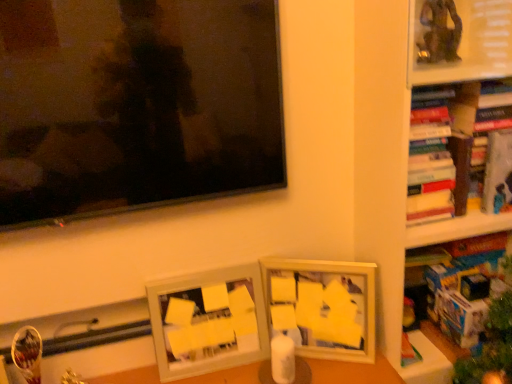
This screenshot has height=384, width=512. What are the coordinates of `hardcover book at upper right, the second book positioned from the bottom` in the screenshot? It's located at (498, 173).

You are a GUI agent. You are given a task and a screenshot of the screen. Output one action in this format:
    pyautogui.click(x=<x>, y=<y>)
    Task: Click on the hardcover book at upper right, the first book positioned from the top
    This screenshot has width=512, height=384.
    Given the screenshot: What is the action you would take?
    pyautogui.click(x=444, y=146)

Based on the photo, what is the approximate height of matte black television at upper left?

The height of matte black television at upper left is 21.85 inches.

The height and width of the screenshot is (384, 512). Identify the location of matte white picture frame at center, arranged as the 1th picture frame when viewed from the right. (326, 305).

The width and height of the screenshot is (512, 384). Identify the location of wooden bookshelf at right. pyautogui.click(x=456, y=116).

Image resolution: width=512 pixels, height=384 pixels. In order to click on blue cardboard book at right, arranged as the 3th book when viewed from the top in this screenshot , I will do `click(462, 283)`.

Consider the image. Would you say matte white picture frame at center, arranged as the 1th picture frame when viewed from the right, is a long distance from white matte picture frame at center, which is the 2th picture frame from right to left?

matte white picture frame at center, arranged as the 1th picture frame when viewed from the right, is actually quite close to white matte picture frame at center, which is the 2th picture frame from right to left.

How many degrees apart are the facing directions of matte white picture frame at center, arranged as the 1th picture frame when viewed from the right, and white matte picture frame at center, which is the 2th picture frame from right to left?

The angular difference between matte white picture frame at center, arranged as the 1th picture frame when viewed from the right, and white matte picture frame at center, which is the 2th picture frame from right to left, is 25.9 degrees.

Is matte white picture frame at center, the 2th picture frame when ordered from left to right, oriented towards white matte picture frame at center, which is counted as the 1th picture frame, starting from the left?

No, matte white picture frame at center, the 2th picture frame when ordered from left to right, is not turned towards white matte picture frame at center, which is counted as the 1th picture frame, starting from the left.

From the picture: From a real-world perspective, does matte white picture frame at center, the 2th picture frame when ordered from left to right, sit lower than white matte picture frame at center, which is counted as the 1th picture frame, starting from the left?

Yes, from a real-world perspective, matte white picture frame at center, the 2th picture frame when ordered from left to right, is below white matte picture frame at center, which is counted as the 1th picture frame, starting from the left.

Does white matte picture frame at center, which is the 2th picture frame from right to left, turn towards hardcover book at upper right, the 2th book when ordered from top to bottom?

A: No, white matte picture frame at center, which is the 2th picture frame from right to left, is not aimed at hardcover book at upper right, the 2th book when ordered from top to bottom.

Based on their positions, is white matte picture frame at center, which is counted as the 1th picture frame, starting from the left, located to the left or right of hardcover book at upper right, the second book positioned from the bottom?

white matte picture frame at center, which is counted as the 1th picture frame, starting from the left, is to the left of hardcover book at upper right, the second book positioned from the bottom.

Which of these two, white matte picture frame at center, which is the 2th picture frame from right to left, or hardcover book at upper right, the second book positioned from the bottom, is smaller?

With smaller size is hardcover book at upper right, the second book positioned from the bottom.

Which is in front, white matte picture frame at center, which is counted as the 1th picture frame, starting from the left, or hardcover book at upper right, the second book positioned from the bottom?

hardcover book at upper right, the second book positioned from the bottom, is in front.

Which is in front, point (264, 281) or point (465, 269)?

The point (264, 281) is more forward.

Is matte white picture frame at center, the 2th picture frame when ordered from left to right, closer to camera compared to blue cardboard book at right, arranged as the 3th book when viewed from the top?

No, it is not.

Is matte white picture frame at center, arranged as the 1th picture frame when viewed from the right, situated inside blue cardboard book at right, acting as the 1th book starting from the bottom, or outside?

matte white picture frame at center, arranged as the 1th picture frame when viewed from the right, is located beyond the bounds of blue cardboard book at right, acting as the 1th book starting from the bottom.

From the image's perspective, relative to blue cardboard book at right, arranged as the 3th book when viewed from the top, is matte white picture frame at center, arranged as the 1th picture frame when viewed from the right, above or below?

From the image's perspective, matte white picture frame at center, arranged as the 1th picture frame when viewed from the right, appears below blue cardboard book at right, arranged as the 3th book when viewed from the top.

Measure the distance between blue cardboard book at right, acting as the 1th book starting from the bottom, and white matte picture frame at center, which is the 2th picture frame from right to left.

26.45 inches.

From the image's perspective, is blue cardboard book at right, acting as the 1th book starting from the bottom, located above or below white matte picture frame at center, which is the 2th picture frame from right to left?

From the image's perspective, blue cardboard book at right, acting as the 1th book starting from the bottom, appears above white matte picture frame at center, which is the 2th picture frame from right to left.

Is blue cardboard book at right, acting as the 1th book starting from the bottom, to the left or to the right of white matte picture frame at center, which is the 2th picture frame from right to left, in the image?

From the image, it's evident that blue cardboard book at right, acting as the 1th book starting from the bottom, is to the right of white matte picture frame at center, which is the 2th picture frame from right to left.

Are blue cardboard book at right, acting as the 1th book starting from the bottom, and white matte picture frame at center, which is the 2th picture frame from right to left, located far from each other?

No, blue cardboard book at right, acting as the 1th book starting from the bottom, is not far away from white matte picture frame at center, which is the 2th picture frame from right to left.

Is blue cardboard book at right, acting as the 1th book starting from the bottom, inside the boundaries of hardcover book at upper right, the second book positioned from the bottom, or outside?

blue cardboard book at right, acting as the 1th book starting from the bottom, is located beyond the bounds of hardcover book at upper right, the second book positioned from the bottom.

In the scene shown: Considering the sizes of objects blue cardboard book at right, arranged as the 3th book when viewed from the top, and hardcover book at upper right, the second book positioned from the bottom, in the image provided, who is smaller, blue cardboard book at right, arranged as the 3th book when viewed from the top, or hardcover book at upper right, the second book positioned from the bottom,?

hardcover book at upper right, the second book positioned from the bottom.

Is blue cardboard book at right, arranged as the 3th book when viewed from the top, wider or thinner than hardcover book at upper right, the 2th book when ordered from top to bottom?

Clearly, blue cardboard book at right, arranged as the 3th book when viewed from the top, has more width compared to hardcover book at upper right, the 2th book when ordered from top to bottom.

Is blue cardboard book at right, arranged as the 3th book when viewed from the top, facing towards hardcover book at upper right, the 2th book when ordered from top to bottom?

No, blue cardboard book at right, arranged as the 3th book when viewed from the top, is not turned towards hardcover book at upper right, the 2th book when ordered from top to bottom.

From the picture: Is wooden bookshelf at right looking in the opposite direction of matte white picture frame at center, arranged as the 1th picture frame when viewed from the right?

That's not correct — wooden bookshelf at right is not looking away from matte white picture frame at center, arranged as the 1th picture frame when viewed from the right.

Is point (500, 228) positioned behind point (311, 349)?

That is False.

Where is `the 1st picture frame to the left of the wooden bookshelf at right, counting from the anchor's position`? This screenshot has width=512, height=384. the 1st picture frame to the left of the wooden bookshelf at right, counting from the anchor's position is located at coordinates (326, 305).

Can you confirm if wooden bookshelf at right is bigger than matte white picture frame at center, the 2th picture frame when ordered from left to right?

Correct, wooden bookshelf at right is larger in size than matte white picture frame at center, the 2th picture frame when ordered from left to right.

Is blue cardboard book at right, acting as the 1th book starting from the bottom, located within wooden bookshelf at right?

Yes, blue cardboard book at right, acting as the 1th book starting from the bottom, is surrounded by wooden bookshelf at right.

Looking at this image, is wooden bookshelf at right taller than blue cardboard book at right, acting as the 1th book starting from the bottom?

Yes, wooden bookshelf at right is taller than blue cardboard book at right, acting as the 1th book starting from the bottom.

Identify the location of the 1st book behind the wooden bookshelf at right. (462, 283).

How different are the orientations of wooden bookshelf at right and blue cardboard book at right, arranged as the 3th book when viewed from the top, in degrees?

They differ by 1.89 degrees in their facing directions.

Find the location of a particular element. This screenshot has height=384, width=512. picture frame located on the left of matte white picture frame at center, arranged as the 1th picture frame when viewed from the right is located at coordinates (208, 321).

Where is `the 1st book in front of the white matte picture frame at center, which is counted as the 1th picture frame, starting from the left, counting from the anchor's position`? the 1st book in front of the white matte picture frame at center, which is counted as the 1th picture frame, starting from the left, counting from the anchor's position is located at coordinates (498, 173).

Estimate the real-world distances between objects in this image. Which object is closer to blue cardboard book at right, arranged as the 3th book when viewed from the top, matte black television at upper left or white matte picture frame at center, which is counted as the 1th picture frame, starting from the left?

white matte picture frame at center, which is counted as the 1th picture frame, starting from the left, lies closer to blue cardboard book at right, arranged as the 3th book when viewed from the top, than the other object.

Looking at the image, which one is located further to hardcover book at upper right, the second book positioned from the bottom, matte black television at upper left or blue cardboard book at right, acting as the 1th book starting from the bottom?

matte black television at upper left is further to hardcover book at upper right, the second book positioned from the bottom.

When comparing their distances from matte white picture frame at center, arranged as the 1th picture frame when viewed from the right, does hardcover book at upper right, the second book positioned from the bottom, or blue cardboard book at right, arranged as the 3th book when viewed from the top, seem further?

The object further to matte white picture frame at center, arranged as the 1th picture frame when viewed from the right, is hardcover book at upper right, the second book positioned from the bottom.

When comparing their distances from blue cardboard book at right, acting as the 1th book starting from the bottom, does white matte picture frame at center, which is counted as the 1th picture frame, starting from the left, or matte white picture frame at center, arranged as the 1th picture frame when viewed from the right, seem closer?

matte white picture frame at center, arranged as the 1th picture frame when viewed from the right, is positioned closer to the anchor blue cardboard book at right, acting as the 1th book starting from the bottom.

Consider the image. Estimate the real-world distances between objects in this image. Which object is closer to matte white picture frame at center, the 2th picture frame when ordered from left to right, blue cardboard book at right, acting as the 1th book starting from the bottom, or matte black television at upper left?

The object closer to matte white picture frame at center, the 2th picture frame when ordered from left to right, is blue cardboard book at right, acting as the 1th book starting from the bottom.

Which object lies further to the anchor point matte black television at upper left, blue cardboard book at right, arranged as the 3th book when viewed from the top, or wooden bookshelf at right?

blue cardboard book at right, arranged as the 3th book when viewed from the top, is positioned further to the anchor matte black television at upper left.

Which object lies nearer to the anchor point matte white picture frame at center, the 2th picture frame when ordered from left to right, blue cardboard book at right, arranged as the 3th book when viewed from the top, or wooden bookshelf at right?

Based on the image, blue cardboard book at right, arranged as the 3th book when viewed from the top, appears to be nearer to matte white picture frame at center, the 2th picture frame when ordered from left to right.

When comparing their distances from blue cardboard book at right, arranged as the 3th book when viewed from the top, does hardcover book at upper right, the third book ordered from the bottom, or wooden bookshelf at right seem closer?

wooden bookshelf at right.

What are the coordinates of `picture frame situated between white matte picture frame at center, which is the 2th picture frame from right to left, and wooden bookshelf at right from left to right` in the screenshot? It's located at (326, 305).

Find the location of a particular element. The image size is (512, 384). picture frame between matte black television at upper left and white matte picture frame at center, which is the 2th picture frame from right to left, vertically is located at coordinates (326, 305).

The width and height of the screenshot is (512, 384). In order to click on shelf between hardcover book at upper right, the second book positioned from the bottom, and blue cardboard book at right, arranged as the 3th book when viewed from the top, in the up-down direction in this screenshot , I will do pos(456,116).

The image size is (512, 384). What are the coordinates of `book located between white matte picture frame at center, which is the 2th picture frame from right to left, and blue cardboard book at right, arranged as the 3th book when viewed from the top, in the left-right direction` in the screenshot? It's located at (444, 146).